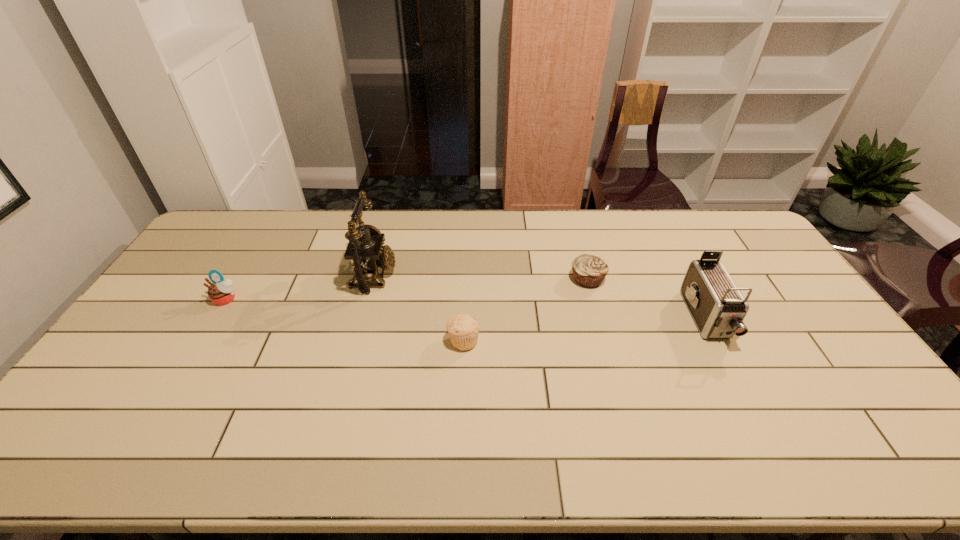
Image resolution: width=960 pixels, height=540 pixels. Identify the location of object that stands as the closest to the second muffin from right to left. (365, 249).

Select which object appears as the fourth closest to the tallest object. Please provide its 2D coordinates. Your answer should be formatted as a tuple, i.e. [(x, y)], where the tuple contains the x and y coordinates of a point satisfying the conditions above.

[(718, 308)]

Identify the location of the second closest muffin to the rightmost muffin. (221, 292).

Find the location of a particular element. muffin that is the second closest to the second muffin from right to left is located at coordinates (221, 292).

The image size is (960, 540). Identify the location of free space that satisfies the following two spatial constraints: 1. on the rotary dial of the fourth object from left to right; 2. on the right side of the telephone. (372, 279).

Identify the location of vacant area that satisfies the following two spatial constraints: 1. on the rotary dial of the telephone; 2. on the back side of the second muffin from left to right. (356, 340).

In order to click on free space that satisfies the following two spatial constraints: 1. on the back side of the second muffin from left to right; 2. on the rotary dial of the tallest object in this screenshot , I will do `click(466, 275)`.

You are a GUI agent. You are given a task and a screenshot of the screen. Output one action in this format:
    pyautogui.click(x=<x>, y=<y>)
    Task: Click on the vacant space that satisfies the following two spatial constraints: 1. on the rotary dial of the second object from right to left; 2. on the right side of the tallest object
    
    Given the screenshot: What is the action you would take?
    pyautogui.click(x=372, y=279)

At what (x,y) coordinates should I click in order to perform the action: click on free space that satisfies the following two spatial constraints: 1. on the rotary dial of the tallest object; 2. on the back side of the second object from right to left. Please return your answer as a coordinate pair (x, y). The height and width of the screenshot is (540, 960). Looking at the image, I should click on point(372,279).